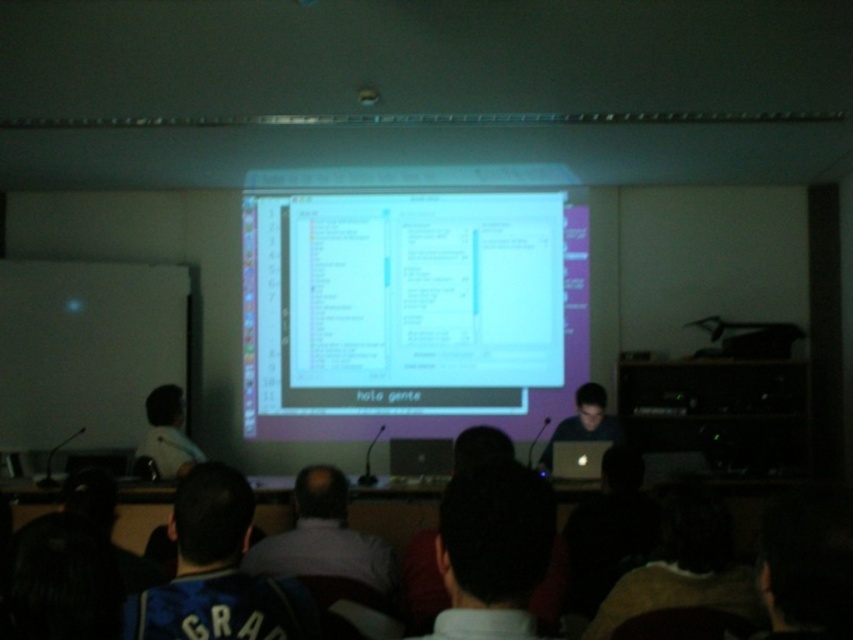
Find the location of a particular element. The width and height of the screenshot is (853, 640). light gray shirt at left is located at coordinates (167, 433).

In the scene shown: Is light gray shirt at left bigger than black matte laptop at center?

No, light gray shirt at left is not bigger than black matte laptop at center.

The height and width of the screenshot is (640, 853). What do you see at coordinates (167, 433) in the screenshot?
I see `light gray shirt at left` at bounding box center [167, 433].

The image size is (853, 640). I want to click on light gray shirt at left, so click(x=167, y=433).

Does white glossy projector screen at center have a greater height compared to light gray shirt at left?

Yes, white glossy projector screen at center is taller than light gray shirt at left.

The width and height of the screenshot is (853, 640). In order to click on white glossy projector screen at center in this screenshot , I will do `click(410, 310)`.

Where is `white glossy projector screen at center`? This screenshot has width=853, height=640. white glossy projector screen at center is located at coordinates (410, 310).

Does blue jersey at lower left have a lesser height compared to light gray shirt at left?

Correct, blue jersey at lower left is not as tall as light gray shirt at left.

Based on the photo, is blue jersey at lower left bigger than light gray shirt at left?

Actually, blue jersey at lower left might be smaller than light gray shirt at left.

The width and height of the screenshot is (853, 640). Describe the element at coordinates (218, 572) in the screenshot. I see `blue jersey at lower left` at that location.

The width and height of the screenshot is (853, 640). What are the coordinates of `blue jersey at lower left` in the screenshot? It's located at (218, 572).